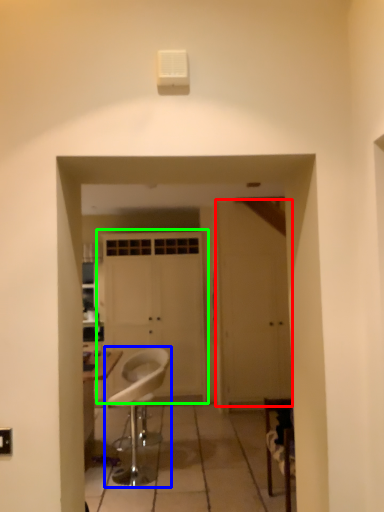
Question: Which object is the farthest from door (highlighted by a red box)? Choose among these: chair (highlighted by a blue box) or door (highlighted by a green box).

Choices:
 (A) chair
 (B) door

Answer: (A)